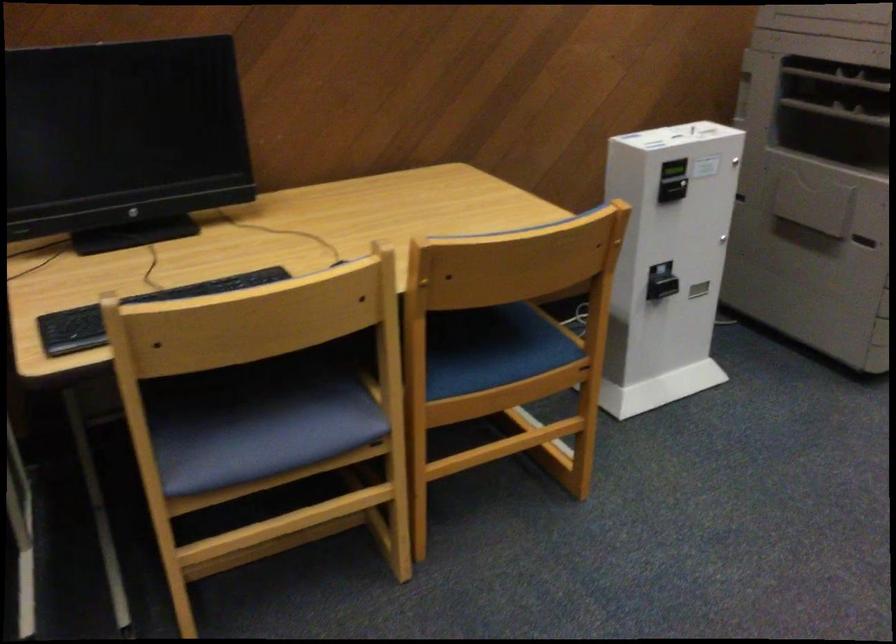
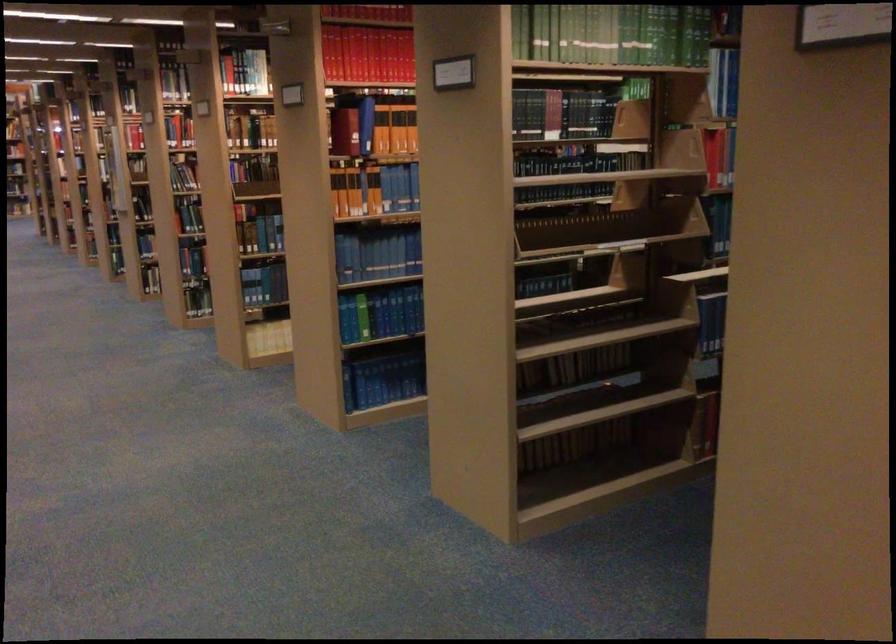
Question: How did the camera likely rotate?

Choices:
 (A) Left
 (B) Right
 (C) Up
 (D) Down

Answer: (B)